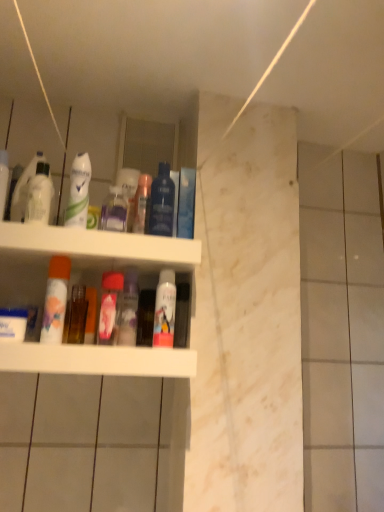
Question: Is point (160, 270) positioned closer to the camera than point (72, 181)?

Choices:
 (A) farther
 (B) closer

Answer: (A)

Question: Considering the positions of white matte mouthwash at center, which appears as the first mouthwash when viewed from the right, and white glossy deodorant at upper left, acting as the second cleaning product starting from the back, in the image, is white matte mouthwash at center, which appears as the first mouthwash when viewed from the right, bigger or smaller than white glossy deodorant at upper left, acting as the second cleaning product starting from the back,?

Choices:
 (A) small
 (B) big

Answer: (A)

Question: Which is nearer to the transparent plastic bottle at upper center, the 1th cleaning product when ordered from back to front?

Choices:
 (A) pink glossy mouthwash at center, which ranks as the third mouthwash in right-to-left order
 (B) white plastic shelf at center
 (C) pink matte spray can at center, which is the first toiletry in left-to-right order
 (D) white glossy deodorant at upper left, the 2th cleaning product in the right-to-left sequence
 (E) translucent plastic bottle at center, the second toiletry from the right

Answer: (E)

Question: Based on their relative distances, which object is farther from the white glossy mouthwash at upper left, marked as the first mouthwash in a left-to-right arrangement?

Choices:
 (A) pink matte spray can at center, which is the first toiletry in left-to-right order
 (B) blue glossy mouthwash at upper center, the 2th mouthwash positioned from the right
 (C) translucent plastic bottle at center, the second toiletry from the right
 (D) transparent plastic bottle at upper center, the 2th cleaning product positioned from the left
 (E) pink glossy mouthwash at center, which ranks as the third mouthwash in right-to-left order

Answer: (A)